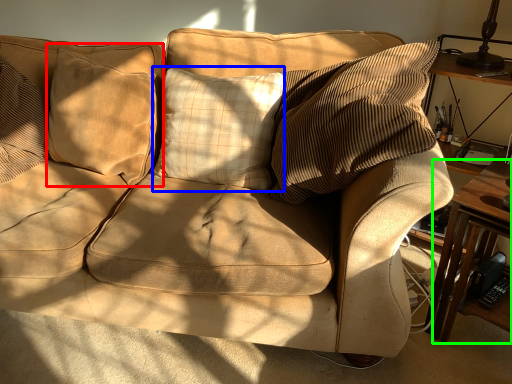
Question: Which object is positioned closest to pillow (highlighted by a red box)? Select from pillow (highlighted by a blue box) and table (highlighted by a green box).

Choices:
 (A) pillow
 (B) table

Answer: (A)